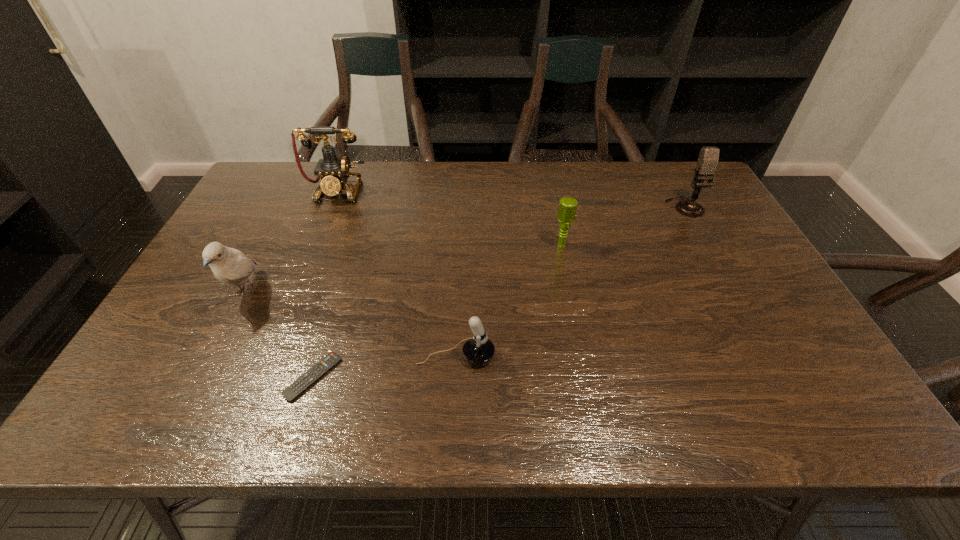
Locate an element on the screen. The width and height of the screenshot is (960, 540). object that is at the far right corner is located at coordinates click(708, 158).

At what (x,y) coordinates should I click in order to perform the action: click on vacant space at the far edge. Please return your answer as a coordinate pair (x, y). Looking at the image, I should click on (656, 191).

In the image, there is a desktop. At what (x,y) coordinates should I click in order to perform the action: click on free region at the near edge. Please return your answer as a coordinate pair (x, y). The image size is (960, 540). Looking at the image, I should click on point(372,415).

In the image, there is a desktop. Where is `vacant space at the left edge`? The image size is (960, 540). vacant space at the left edge is located at coordinates (186, 289).

In order to click on vacant space at the right edge of the desktop in this screenshot , I will do 762,276.

Where is `vacant space at the far left corner of the desktop`? This screenshot has height=540, width=960. vacant space at the far left corner of the desktop is located at coordinates (263, 201).

Locate an element on the screen. The image size is (960, 540). vacant area at the far right corner is located at coordinates (665, 175).

I want to click on vacant area that lies between the second nearest microphone and the shortest object, so click(x=438, y=311).

The height and width of the screenshot is (540, 960). In order to click on unoccupied area between the telephone and the shortest object in this screenshot , I will do `click(325, 284)`.

Identify the location of free space between the telephone and the shortest object. (325, 284).